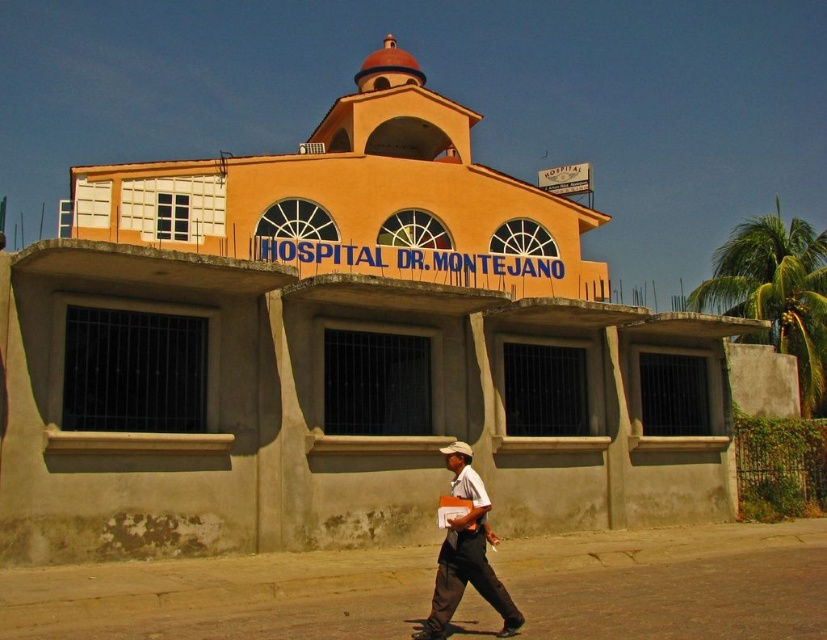
What do you see at coordinates (467, 557) in the screenshot? This screenshot has width=827, height=640. I see `brown cotton shirt at lower center` at bounding box center [467, 557].

Between brown cotton shirt at lower center and white matte cowboy hat at center, which one has less height?

With less height is white matte cowboy hat at center.

Describe the element at coordinates (467, 557) in the screenshot. I see `brown cotton shirt at lower center` at that location.

This screenshot has height=640, width=827. I want to click on brown cotton shirt at lower center, so click(x=467, y=557).